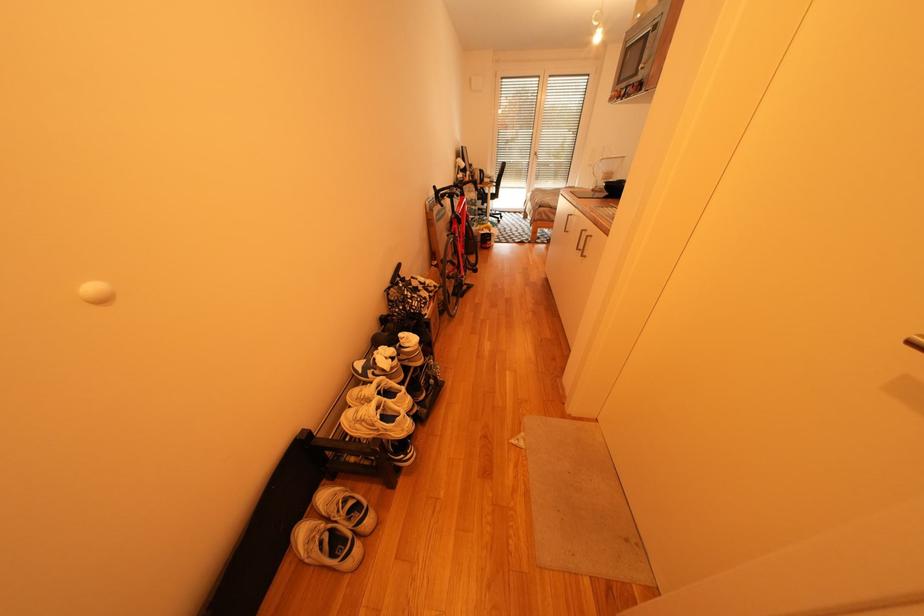
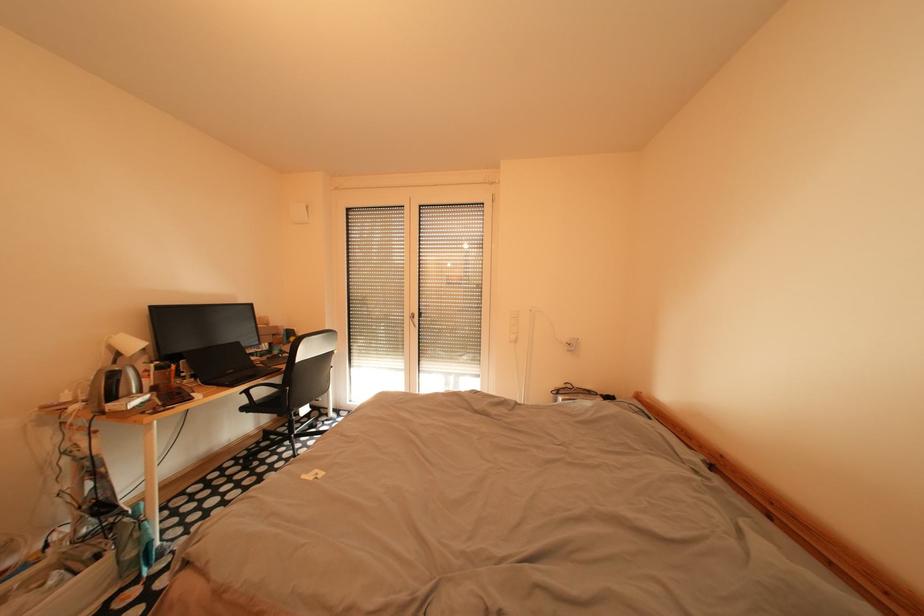
The images are taken continuously from a first-person perspective. In which direction are you moving?

The cameraman walked toward right, forward.